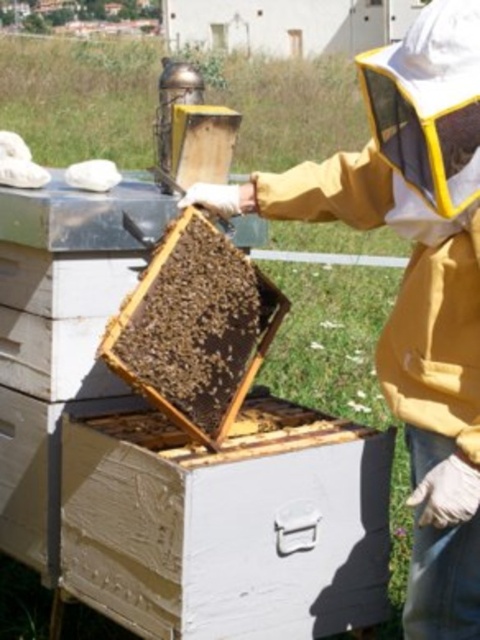
Question: Does yellow fabric beekeeper at center appear over beehive at center?

Choices:
 (A) no
 (B) yes

Answer: (A)

Question: Which object is closer to the camera taking this photo?

Choices:
 (A) yellow fabric beekeeper at center
 (B) beehive at center

Answer: (A)

Question: Does yellow fabric beekeeper at center lie in front of beehive at center?

Choices:
 (A) no
 (B) yes

Answer: (B)

Question: Which of the following is the farthest from the observer?

Choices:
 (A) yellow fabric beekeeper at center
 (B) beehive at center

Answer: (B)

Question: Can you confirm if yellow fabric beekeeper at center is positioned above beehive at center?

Choices:
 (A) yes
 (B) no

Answer: (B)

Question: Which point is farther to the camera?

Choices:
 (A) yellow fabric beekeeper at center
 (B) beehive at center

Answer: (B)